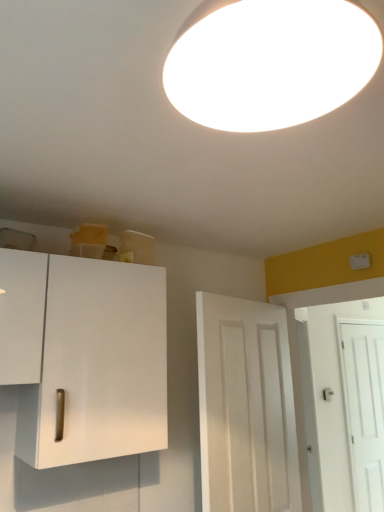
Question: Is white matte light fixture at upper center inside or outside of white matte door at right, which ranks as the second door in back-to-front order?

Choices:
 (A) outside
 (B) inside

Answer: (A)

Question: Considering their positions, is white matte light fixture at upper center located in front of or behind white matte door at right, which ranks as the 2th door in left-to-right order?

Choices:
 (A) behind
 (B) front

Answer: (B)

Question: Which object is the farthest from the white smooth door at center, placed as the first door when sorted from left to right?

Choices:
 (A) white matte light fixture at upper center
 (B) white matte door at right, the 2th door when ordered from front to back
 (C) white matte cabinet at left
 (D) white matte door at right, which is the 1th door in back-to-front order

Answer: (D)

Question: Which is farther from the white smooth door at center, the 1th door in the front-to-back sequence?

Choices:
 (A) white matte door at right, the 3th door positioned from the left
 (B) white matte door at right, which ranks as the 2th door in left-to-right order
 (C) white matte cabinet at left
 (D) white matte light fixture at upper center

Answer: (A)